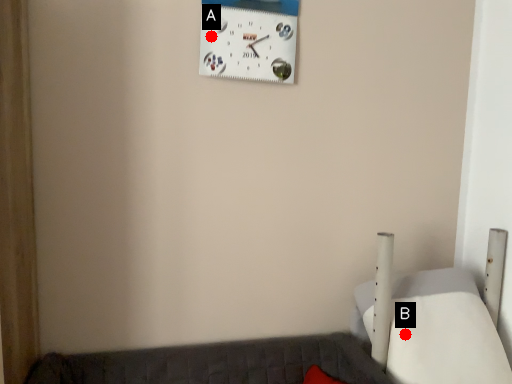
Question: Two points are circled on the image, labeled by A and B beside each circle. Which of the following is the farthest from the observer?

Choices:
 (A) A is further
 (B) B is further

Answer: (A)